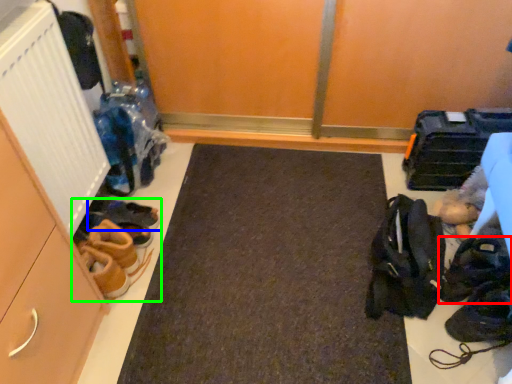
Question: Considering the real-world distances, which object is closest to footwear (highlighted by a red box)? footwear (highlighted by a blue box) or footwear (highlighted by a green box).

Choices:
 (A) footwear
 (B) footwear

Answer: (B)